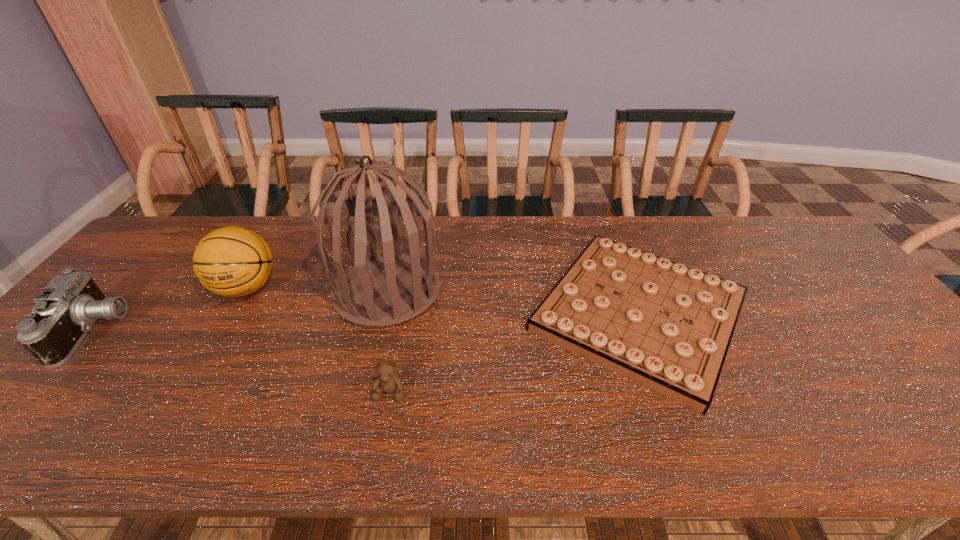
You are a GUI agent. You are given a task and a screenshot of the screen. Output one action in this format:
    pyautogui.click(x=<x>, y=<y>)
    Task: Click on the vacant space located at the lens of the camera
    Image resolution: width=960 pixels, height=540 pixels.
    Given the screenshot: What is the action you would take?
    pyautogui.click(x=238, y=332)

The image size is (960, 540). Find the location of `vacant space positioned on the front-facing side of the second shortest object`. vacant space positioned on the front-facing side of the second shortest object is located at coordinates (382, 437).

This screenshot has height=540, width=960. Find the location of `free space located on the right of the rightmost object`. free space located on the right of the rightmost object is located at coordinates (782, 314).

Where is `birdcage at the far edge`? The width and height of the screenshot is (960, 540). birdcage at the far edge is located at coordinates (384, 289).

This screenshot has height=540, width=960. I want to click on gameboard positioned at the far edge, so click(x=668, y=327).

Image resolution: width=960 pixels, height=540 pixels. I want to click on object that is at the left edge, so click(x=70, y=304).

In order to click on vacant space at the far edge in this screenshot , I will do [x=464, y=219].

Where is `free location at the right edge of the desktop`? The width and height of the screenshot is (960, 540). free location at the right edge of the desktop is located at coordinates (926, 362).

Find the location of a particular element. The image size is (960, 540). free space at the far left corner is located at coordinates (162, 233).

Locate an element on the screen. Image resolution: width=960 pixels, height=540 pixels. free space at the far right corner of the desktop is located at coordinates (781, 239).